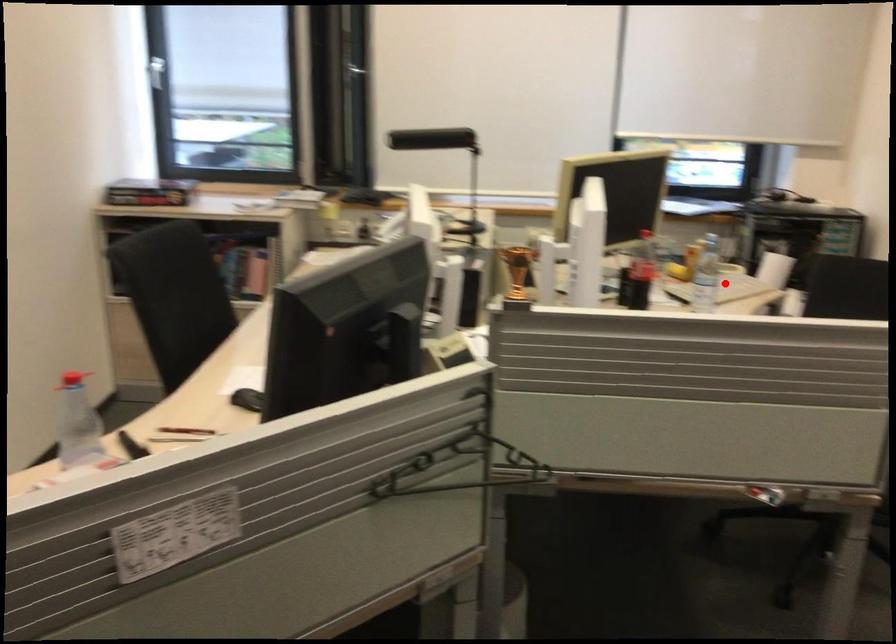
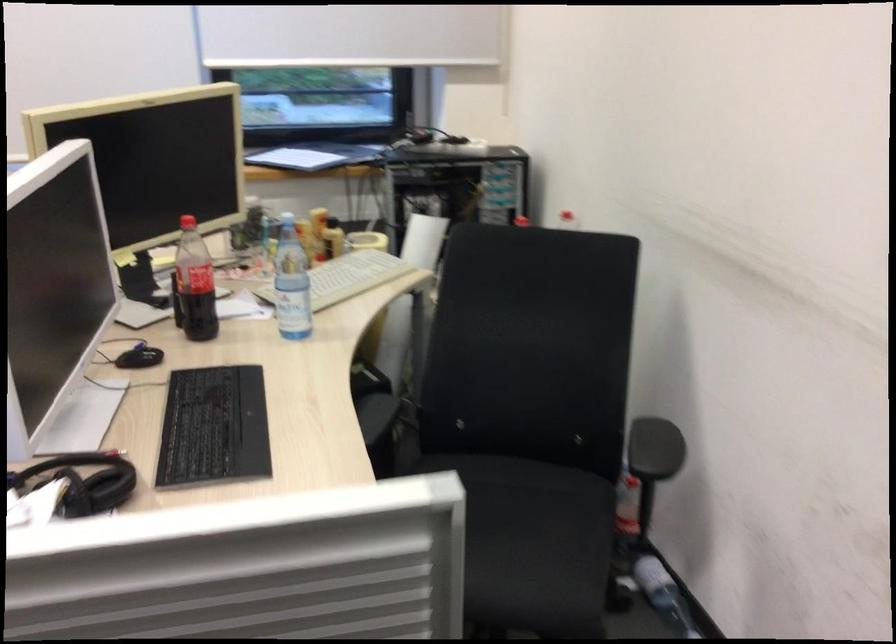
Find the pixel in the second image that matches the highlighted location in the first image.

(347, 277)